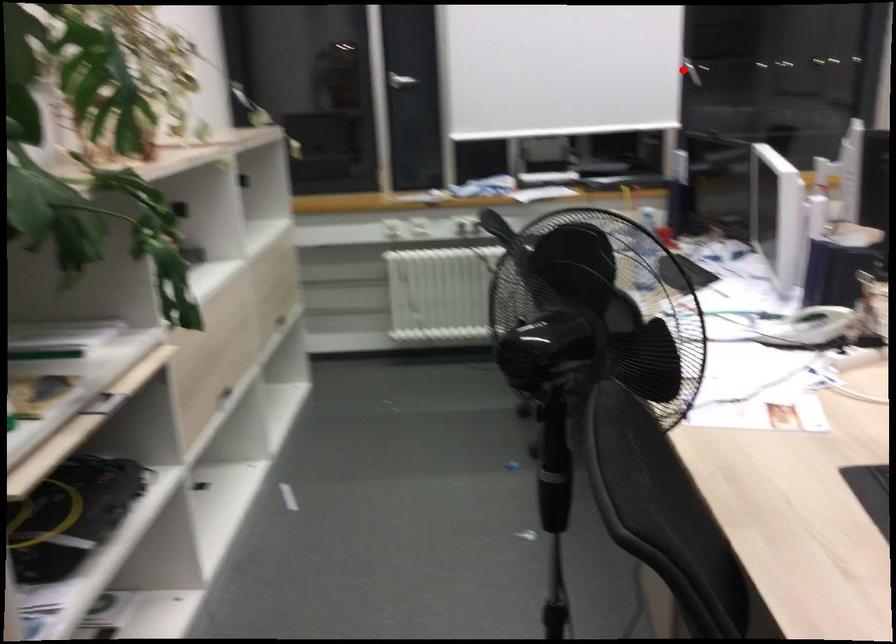
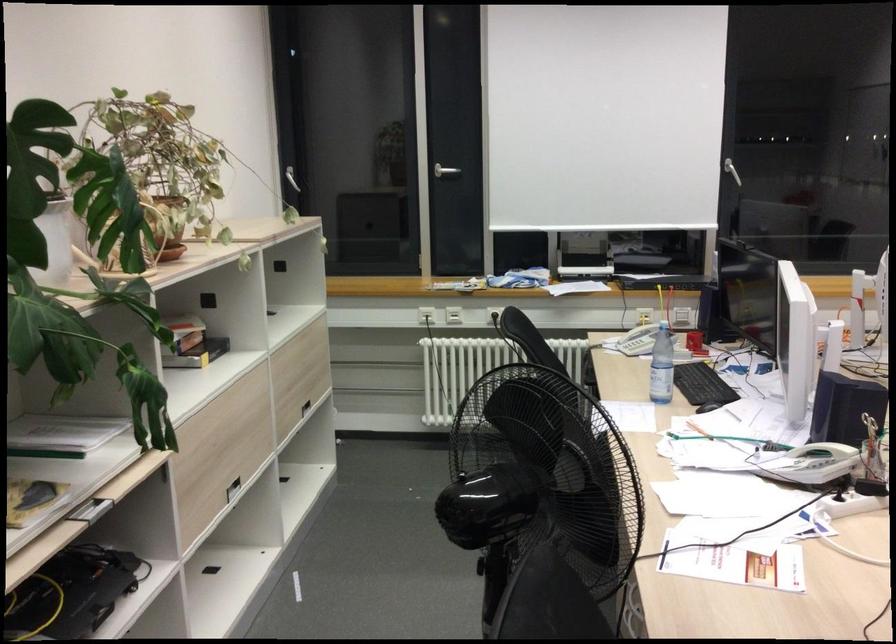
Question: I am providing you with two images of the same scene from different viewpoints. A red point is marked on the first image. Is the red point's position out of view in image 2?

Choices:
 (A) Yes
 (B) No

Answer: (B)